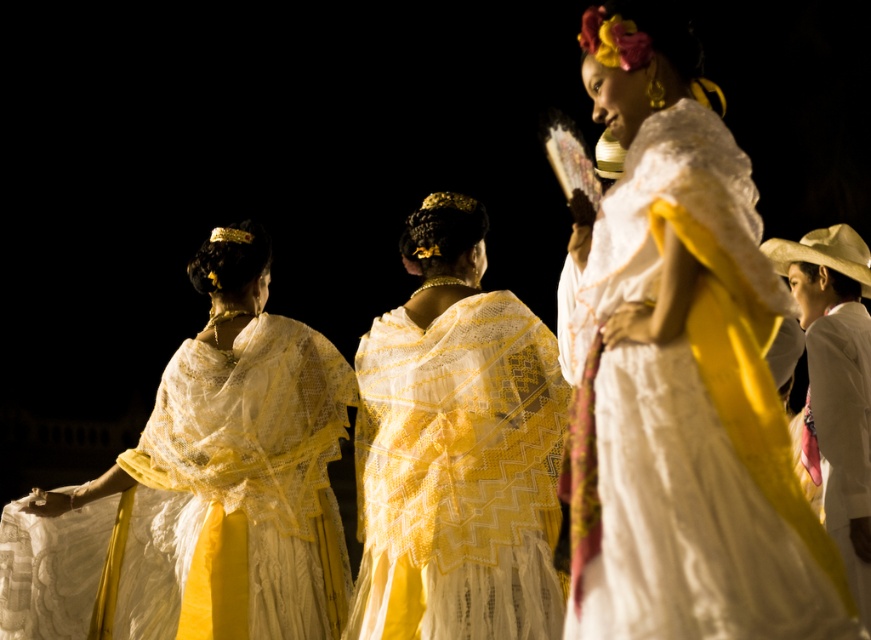
Looking at this image, you are a photographer at a cultural event and need to capture a shot of the matte white dress at center and the white satin robe at right. Based on their positions, which object is located to the left of the other?

The matte white dress at center is positioned on the left side of the white satin robe at right.

You are a photographer at the event. You want to capture a photo where both the white lace dress at center and the white satin robe at right are visible. Which object should you focus on first to ensure both are in frame?

Since the white lace dress at center is smaller in size compared to the white satin robe at right, you should focus on the white lace dress at center first to ensure it is fully captured in the frame while the larger robe remains visible.

You are organizing a fashion show and need to arrange the white lace dress at center and the white satin robe at right on a runway. Since the runway is narrow, you want to ensure that the items with smaller widths are placed first. Which garment should you place first on the runway?

The white lace dress at center has a smaller width than the white satin robe at right, so you should place the white lace dress at center first on the runway to accommodate the narrower space.